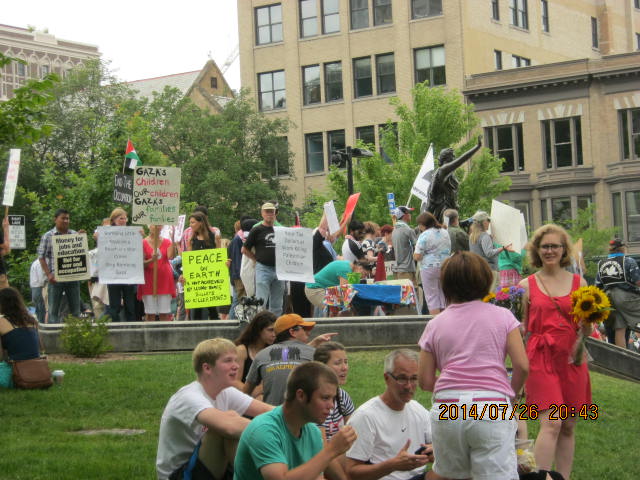
Where is `window`? The image size is (640, 480). window is located at coordinates (328, 80), (563, 142).